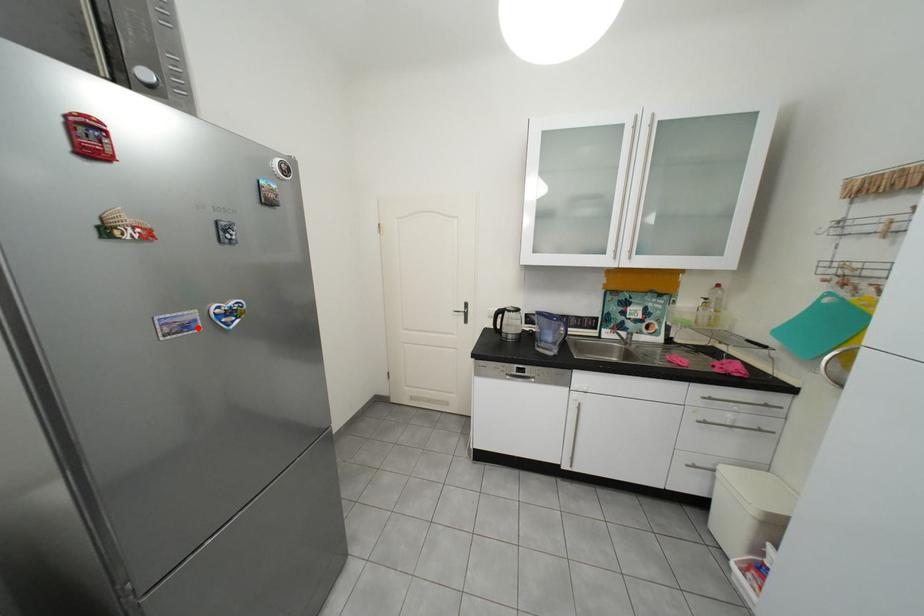
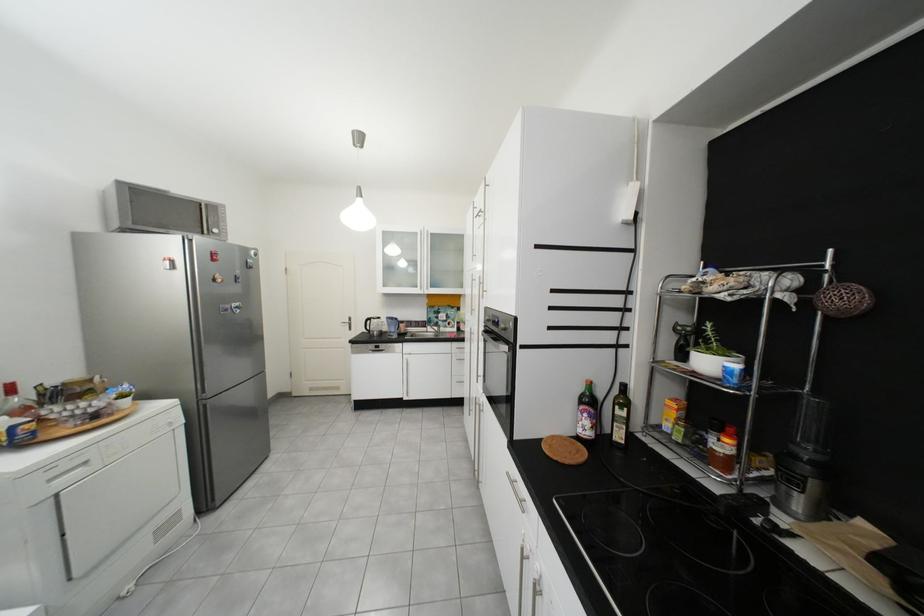
Locate, in the second image, the point that corresponds to the highlighted location in the first image.

(237, 310)